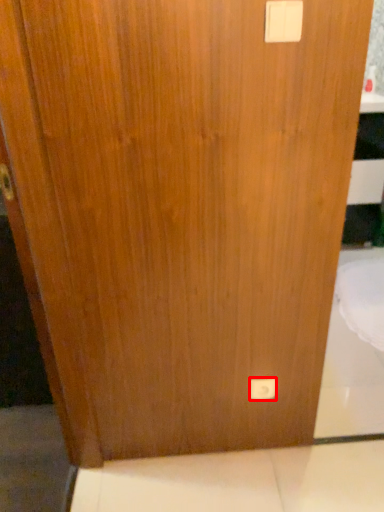
Question: Where is light switch (annotated by the red box) located in relation to light switch in the image?

Choices:
 (A) left
 (B) right

Answer: (B)